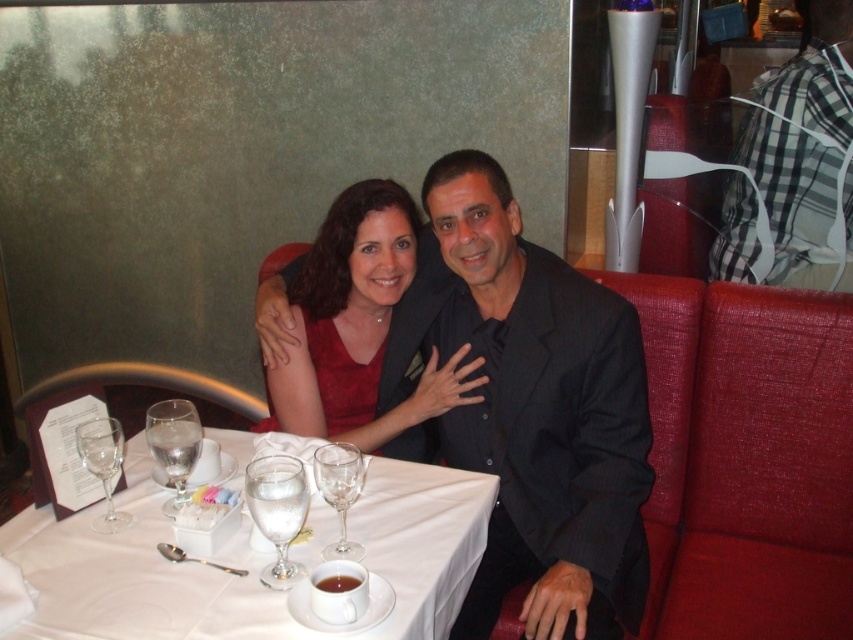
You are a photographer standing 2 meters away from the checkered fabric shirt at upper right and the clear glass wine glass at lower left. You want to move closer to take a photo. If you move 0.5 meters forward, will both objects still be within your camera frame?

The checkered fabric shirt at upper right is 1.82 meters away from the clear glass wine glass at lower left. Moving 0.5 meters forward reduces the distance between you and both objects to 1.5 meters. Since both objects are now closer and within a 1.5 meter range, they should still be within your camera frame.

You are a photographer trying to capture a clear shot of the clear glass wine glass at lower left and the checkered fabric shirt at upper right. Which object is closer to the camera?

The checkered fabric shirt at upper right is closer to the camera than the clear glass wine glass at lower left because the wine glass is positioned behind the shirt.